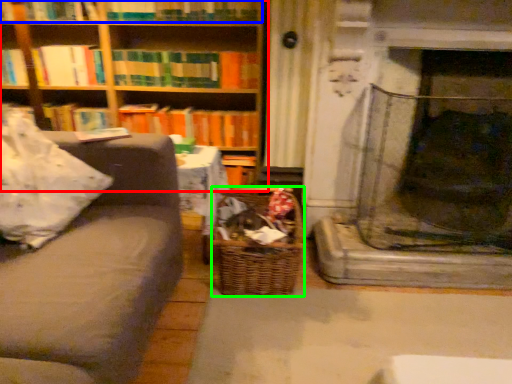
Question: Estimate the real-world distances between objects in this image. Which object is closer to bookcase (highlighted by a red box), book (highlighted by a blue box) or basket (highlighted by a green box)?

Choices:
 (A) book
 (B) basket

Answer: (A)